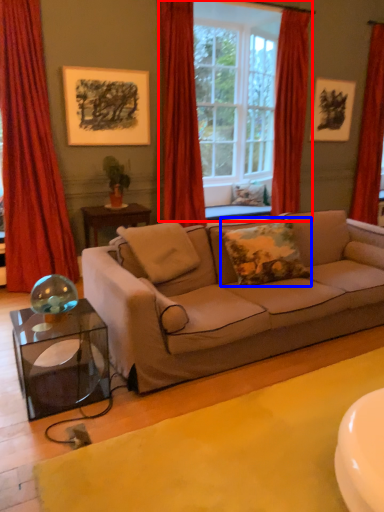
Question: Which point is closer to the camera, window (highlighted by a red box) or pillow (highlighted by a blue box)?

Choices:
 (A) window
 (B) pillow

Answer: (B)